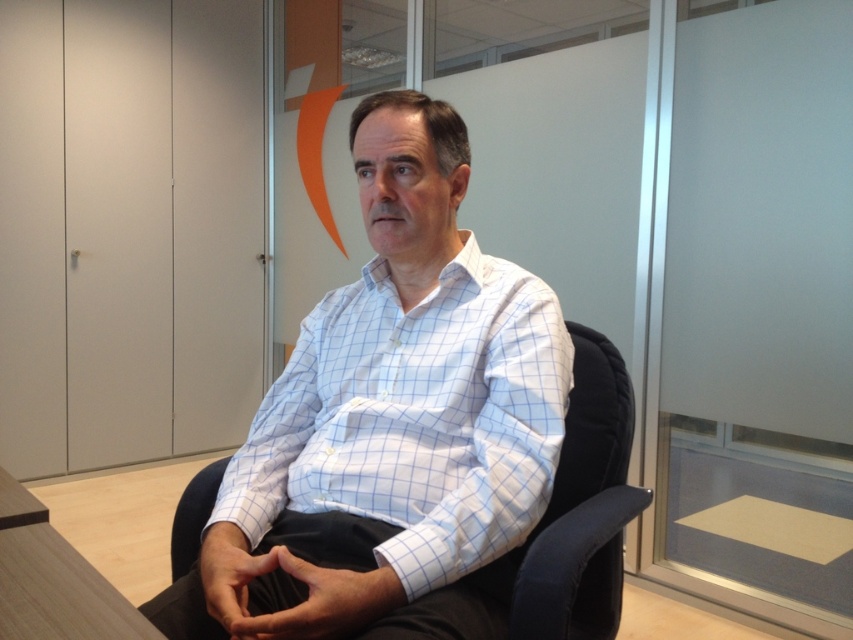
You are an interior designer assessing the office layout. You notice the white checkered shirt at center and the black fabric swivel chair at center. Which object occupies a smaller vertical space in the image?

The white checkered shirt at center has a lesser height compared to the black fabric swivel chair at center, so the white checkered shirt at center occupies a smaller vertical space.